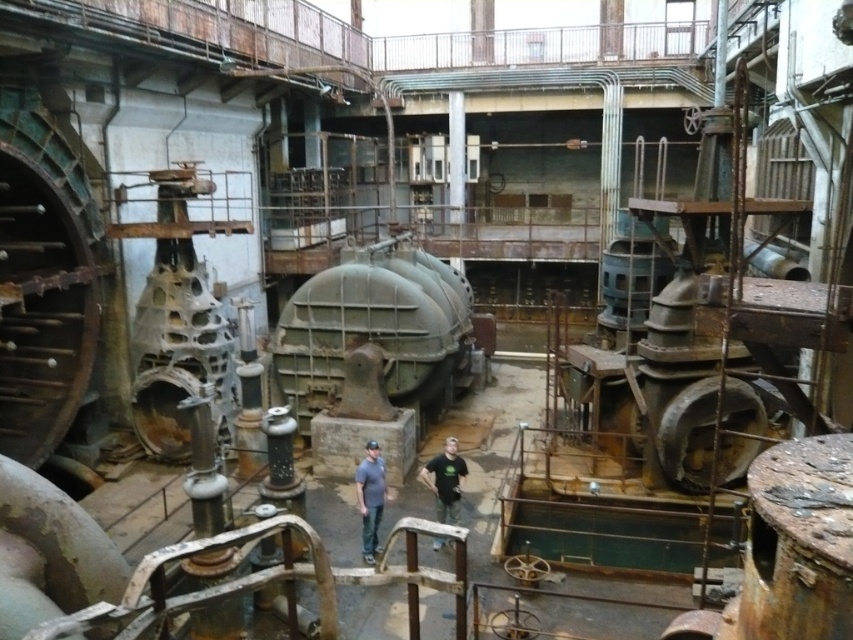
Between matte gray shirt at center and black cotton shirt at center, which one is positioned higher?

black cotton shirt at center is above.

Locate an element on the screen. matte gray shirt at center is located at coordinates (370, 497).

At what (x,y) coordinates should I click in order to perform the action: click on matte gray shirt at center. Please return your answer as a coordinate pair (x, y). This screenshot has height=640, width=853. Looking at the image, I should click on (370, 497).